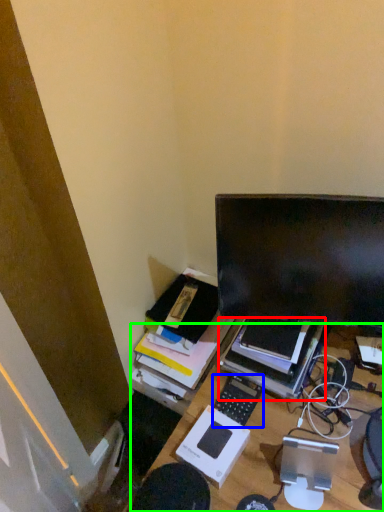
Question: Which object is the closest to the computer (highlighted by a red box)? Choose among these: computer keyboard (highlighted by a blue box) or desk (highlighted by a green box).

Choices:
 (A) computer keyboard
 (B) desk

Answer: (A)